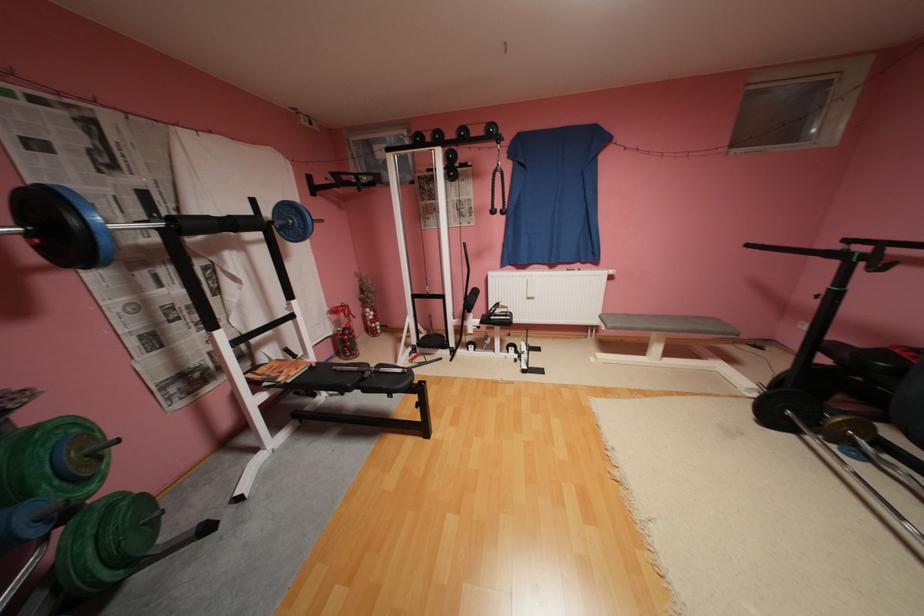
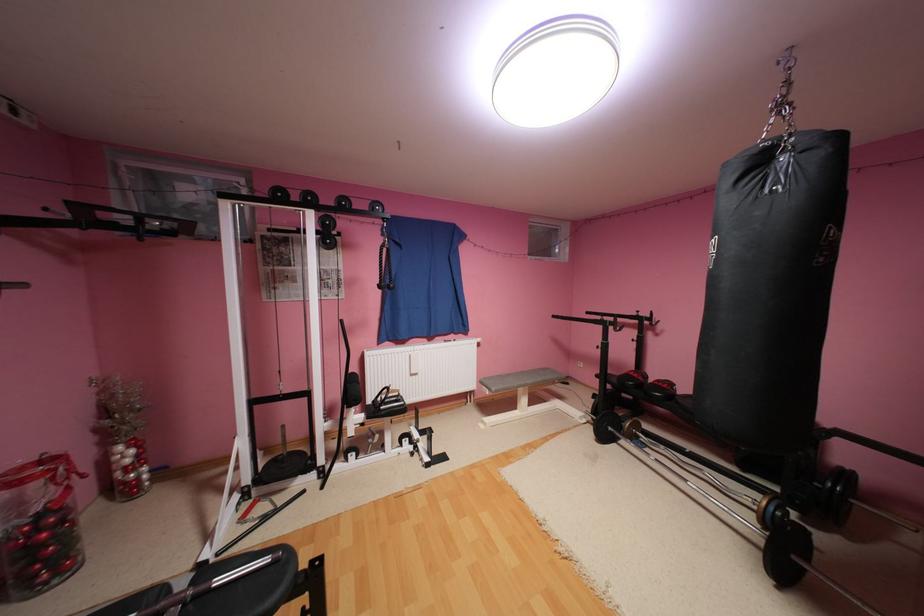
In the second image, find the point that corresponds to [764,395] in the first image.

(593, 419)